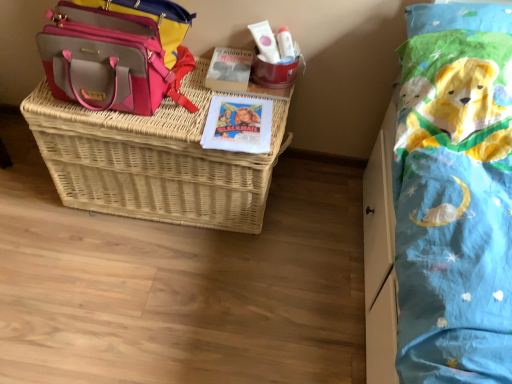
Question: Can you confirm if pink leather shoulder bag at upper left is shorter than woven wicker basket at center?

Choices:
 (A) no
 (B) yes

Answer: (B)

Question: Can you confirm if pink leather shoulder bag at upper left is thinner than woven wicker basket at center?

Choices:
 (A) no
 (B) yes

Answer: (B)

Question: Does pink leather shoulder bag at upper left have a larger size compared to woven wicker basket at center?

Choices:
 (A) yes
 (B) no

Answer: (B)

Question: Is woven wicker basket at center at the back of pink leather shoulder bag at upper left?

Choices:
 (A) no
 (B) yes

Answer: (A)

Question: Can you see pink leather shoulder bag at upper left touching woven wicker basket at center?

Choices:
 (A) no
 (B) yes

Answer: (A)

Question: Would you say pink leather shoulder bag at upper left is outside woven wicker basket at center?

Choices:
 (A) yes
 (B) no

Answer: (A)

Question: Considering the relative sizes of woven wicker basket at center and white matte tube at upper center in the image provided, is woven wicker basket at center taller than white matte tube at upper center?

Choices:
 (A) no
 (B) yes

Answer: (B)

Question: Would you say woven wicker basket at center is outside white matte tube at upper center?

Choices:
 (A) yes
 (B) no

Answer: (A)

Question: Is woven wicker basket at center closer to the viewer compared to white matte tube at upper center?

Choices:
 (A) no
 (B) yes

Answer: (B)

Question: Can you confirm if woven wicker basket at center is wider than white matte tube at upper center?

Choices:
 (A) yes
 (B) no

Answer: (A)

Question: Is woven wicker basket at center positioned behind white matte tube at upper center?

Choices:
 (A) yes
 (B) no

Answer: (B)

Question: Does woven wicker basket at center have a larger size compared to white matte tube at upper center?

Choices:
 (A) no
 (B) yes

Answer: (B)

Question: Does white matte tube at upper center have a greater width compared to woven wicker basket at center?

Choices:
 (A) yes
 (B) no

Answer: (B)